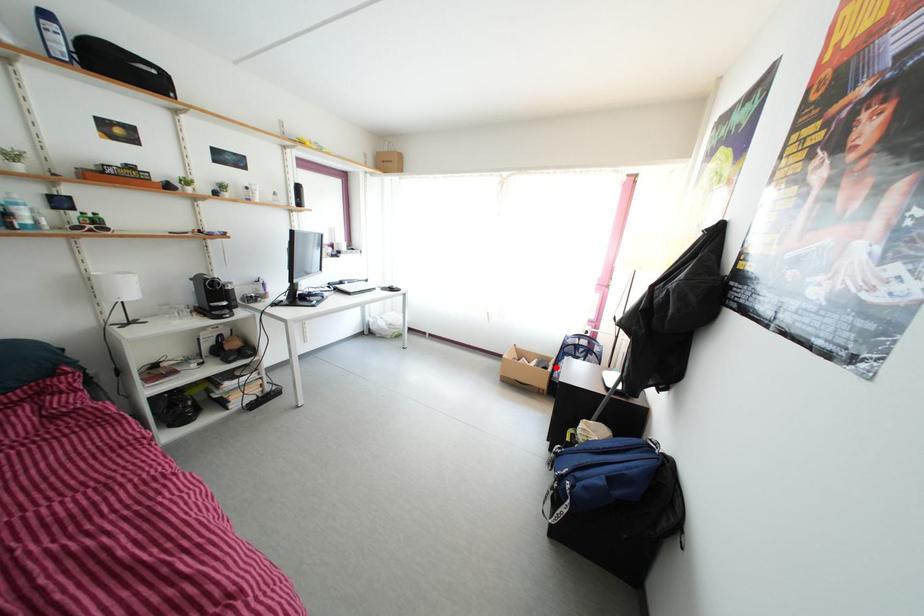
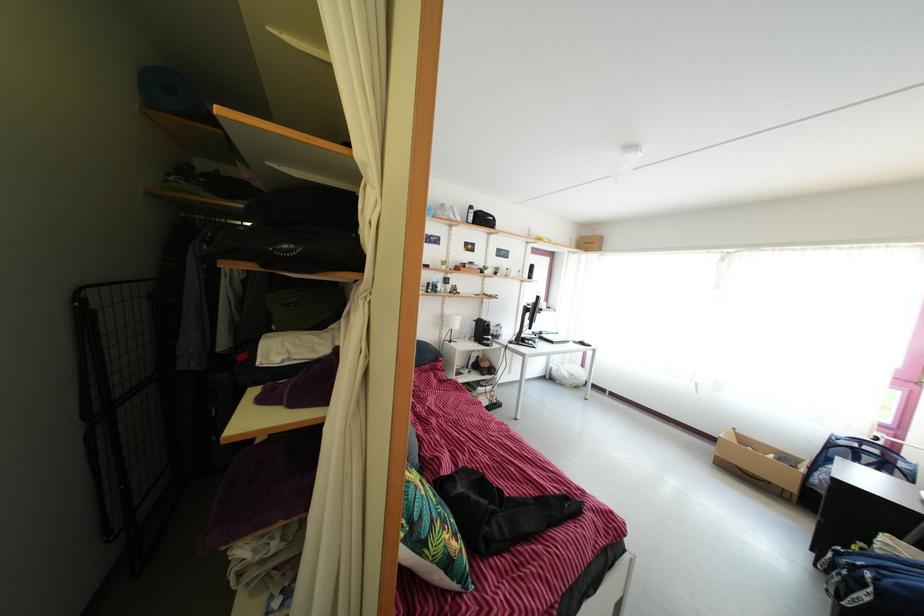
Question: I am providing you with two images of the same scene from different viewpoints. Given a red point in image1, look at the same physical point in image2. Is it:

Choices:
 (A) Closer to the viewpoint
 (B) Farther from the viewpoint

Answer: (B)